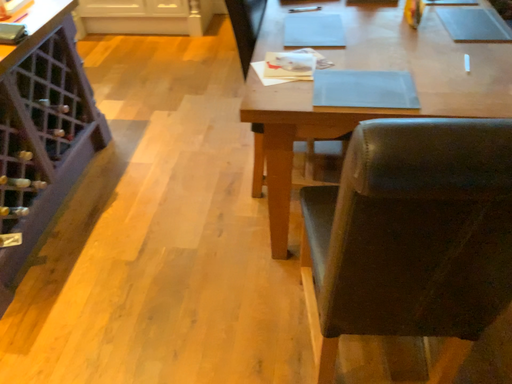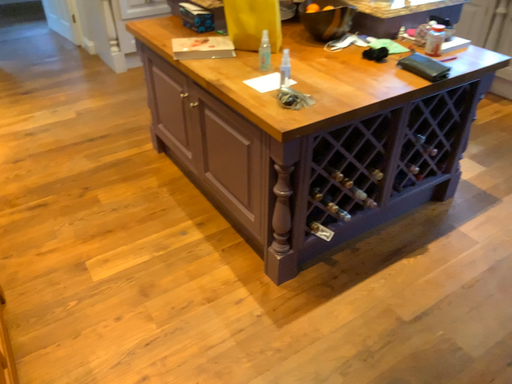
Question: How did the camera likely rotate when shooting the video?

Choices:
 (A) rotated upward
 (B) rotated downward

Answer: (A)